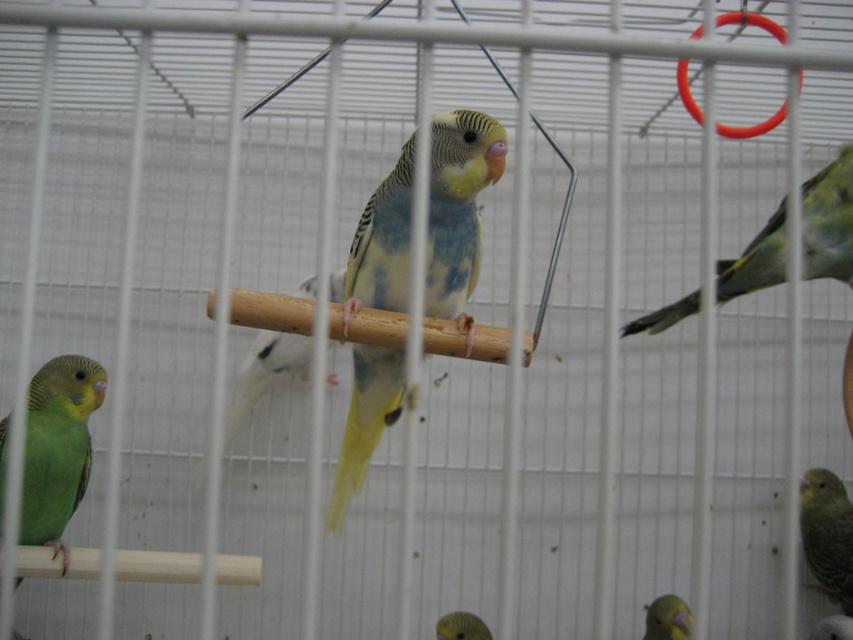
Is point (846, 531) less distant than point (468, 627)?

No.

Image resolution: width=853 pixels, height=640 pixels. What do you see at coordinates (827, 534) in the screenshot? I see `green matte parrot at lower right` at bounding box center [827, 534].

Identify the location of green matte parrot at lower right. The width and height of the screenshot is (853, 640). (827, 534).

Does green matte parrot at right have a larger size compared to yellow matte parrot at lower center?

Yes.

Who is more forward, (x=781, y=269) or (x=683, y=616)?

Positioned in front is point (x=781, y=269).

In order to click on green matte parrot at right in this screenshot , I will do `click(828, 220)`.

Is yellow-green feathered parrot at center shorter than green matte parrot at lower right?

No, yellow-green feathered parrot at center is not shorter than green matte parrot at lower right.

Can you confirm if yellow-green feathered parrot at center is positioned below green matte parrot at lower right?

Incorrect, yellow-green feathered parrot at center is not positioned below green matte parrot at lower right.

Which is in front, point (367, 433) or point (815, 512)?

Point (367, 433) is more forward.

At what (x,y) coordinates should I click in order to perform the action: click on yellow-green feathered parrot at center. Please return your answer as a coordinate pair (x, y). The width and height of the screenshot is (853, 640). Looking at the image, I should click on (457, 209).